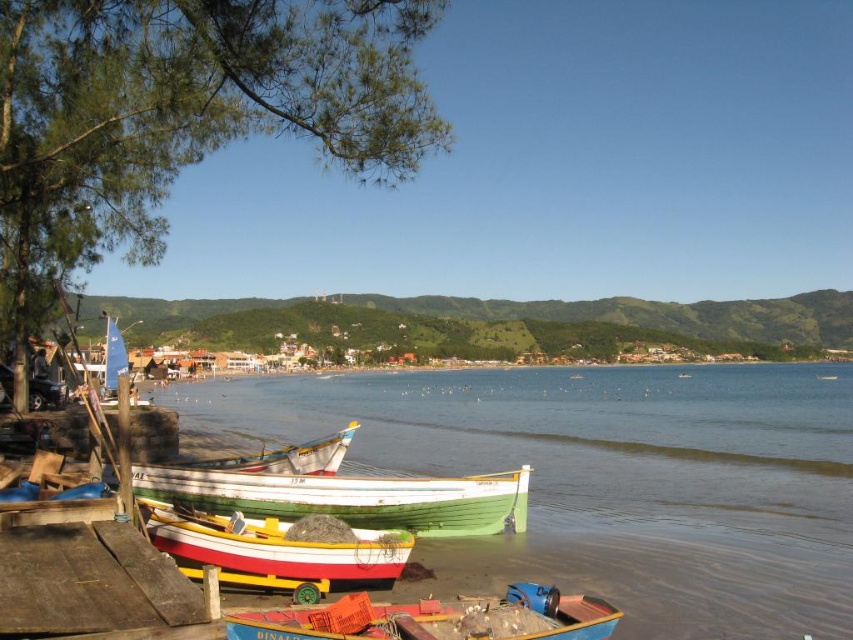
Question: Observing the image, what is the correct spatial positioning of clear water at center in reference to green wooden boat at center?

Choices:
 (A) above
 (B) below

Answer: (B)

Question: Which object is the farthest from the green wooden boat at center?

Choices:
 (A) wooden at lower left
 (B) blue plastic boat at lower center
 (C) clear water at center
 (D) white wooden boat at center

Answer: (C)

Question: Which object is positioned closest to the green wooden boat at center?

Choices:
 (A) wooden at lower left
 (B) clear water at center
 (C) blue plastic boat at lower center

Answer: (A)

Question: Is green wooden boat at center below blue plastic boat at lower center?

Choices:
 (A) yes
 (B) no

Answer: (A)

Question: Which point appears closest to the camera in this image?

Choices:
 (A) (508, 573)
 (B) (0, 609)
 (C) (238, 632)
 (D) (403, 484)

Answer: (C)

Question: Can you confirm if wooden at lower left is positioned to the right of blue plastic boat at lower center?

Choices:
 (A) no
 (B) yes

Answer: (A)